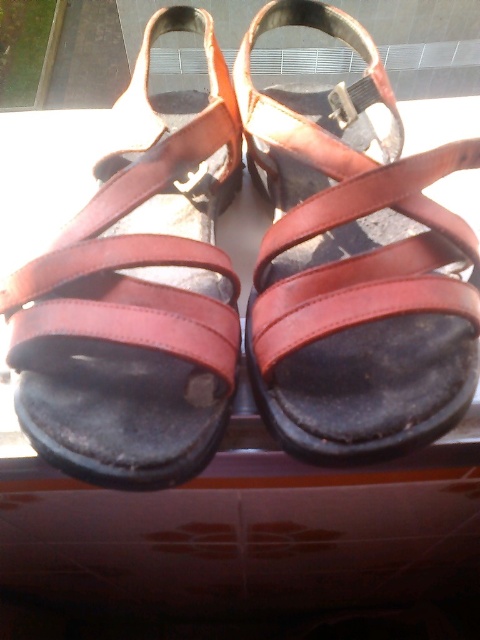
From the picture: Can you confirm if brown leather sandal at center is smaller than brown leather sandals at center?

Incorrect, brown leather sandal at center is not smaller in size than brown leather sandals at center.

You are a GUI agent. You are given a task and a screenshot of the screen. Output one action in this format:
    pyautogui.click(x=<x>, y=<y>)
    Task: Click on the brown leather sandal at center
    Image resolution: width=480 pixels, height=640 pixels.
    Given the screenshot: What is the action you would take?
    pyautogui.click(x=352, y=264)

Is point (326, 189) positioned in front of point (21, 440)?

Yes.

The width and height of the screenshot is (480, 640). I want to click on brown leather sandal at center, so click(352, 264).

Can you confirm if leather sandals at center is positioned above brown leather sandals at center?

No, leather sandals at center is not above brown leather sandals at center.

Based on the photo, is leather sandals at center below brown leather sandals at center?

Yes, leather sandals at center is below brown leather sandals at center.

Measure the distance between point [47,442] and camera.

The distance of point [47,442] from camera is 26.28 inches.

Find the location of a particular element. leather sandals at center is located at coordinates (136, 292).

Who is positioned more to the right, brown leather sandal at center or leather sandals at center?

Positioned to the right is brown leather sandal at center.

The height and width of the screenshot is (640, 480). What do you see at coordinates (352, 264) in the screenshot?
I see `brown leather sandal at center` at bounding box center [352, 264].

You are a GUI agent. You are given a task and a screenshot of the screen. Output one action in this format:
    pyautogui.click(x=<x>, y=<y>)
    Task: Click on the brown leather sandal at center
    Image resolution: width=480 pixels, height=640 pixels.
    Given the screenshot: What is the action you would take?
    pyautogui.click(x=352, y=264)